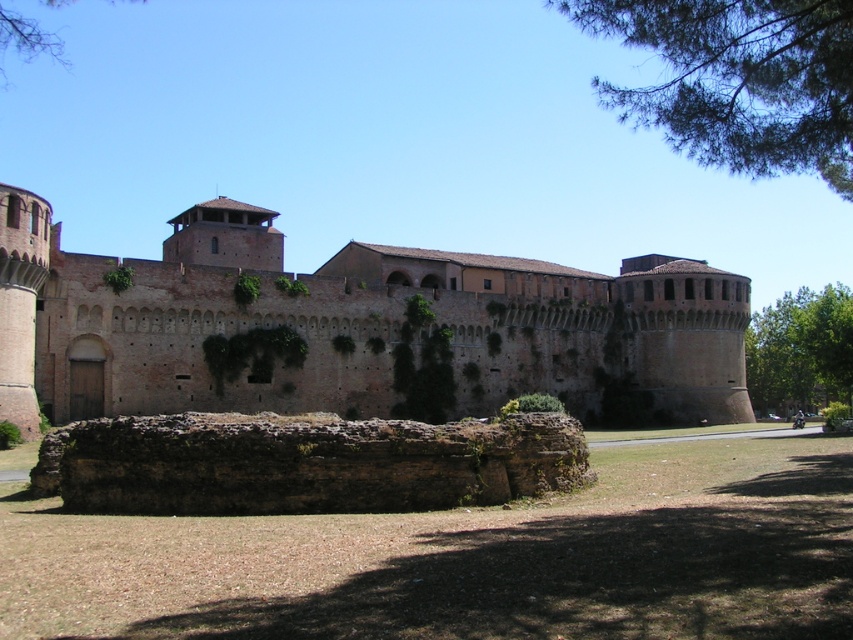
Based on the photo, which is below, brown brick wall at center or green leafy tree at upper left?

brown brick wall at center is lower down.

Can you confirm if brown brick wall at center is positioned above green leafy tree at upper left?

Actually, brown brick wall at center is below green leafy tree at upper left.

Is point (677, 264) farther from camera compared to point (61, 44)?

No, (677, 264) is in front of (61, 44).

You are a GUI agent. You are given a task and a screenshot of the screen. Output one action in this format:
    pyautogui.click(x=<x>, y=<y>)
    Task: Click on the brown brick wall at center
    The width and height of the screenshot is (853, 640).
    Given the screenshot: What is the action you would take?
    click(347, 324)

Does brown brick wall at center have a larger size compared to green leafy tree at right?

Actually, brown brick wall at center might be smaller than green leafy tree at right.

Can you confirm if brown brick wall at center is taller than green leafy tree at right?

Yes, brown brick wall at center is taller than green leafy tree at right.

The height and width of the screenshot is (640, 853). Identify the location of brown brick wall at center. (347, 324).

Identify the location of brown brick wall at center. (347, 324).

Consider the image. Which is more to the left, green leafy tree at upper right or green leafy tree at upper left?

green leafy tree at upper left is more to the left.

What do you see at coordinates (738, 80) in the screenshot?
I see `green leafy tree at upper right` at bounding box center [738, 80].

Between point (851, 182) and point (49, 4), which one is positioned behind?

The point (49, 4) is more distant.

Locate an element on the screen. The width and height of the screenshot is (853, 640). green leafy tree at upper right is located at coordinates (738, 80).